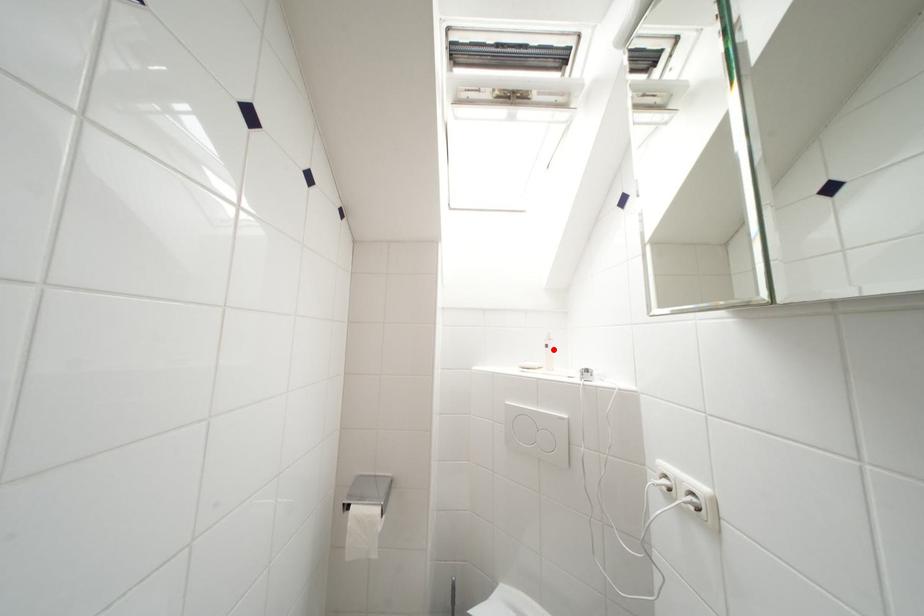
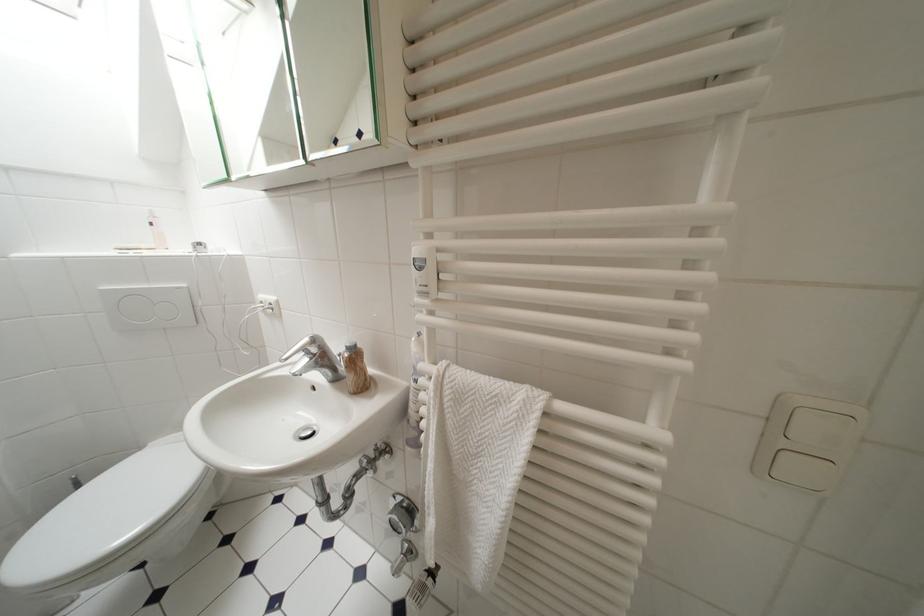
Find the pixel in the second image that matches the highlighted location in the first image.

(159, 227)